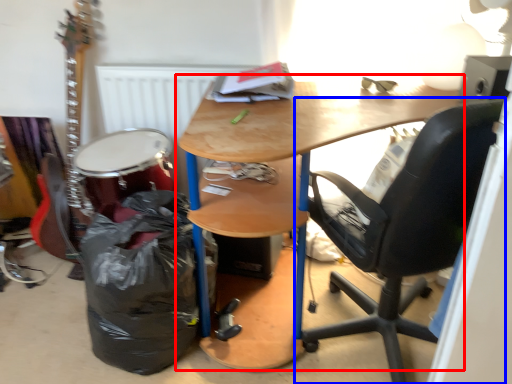
Question: Which object is closer to the camera taking this photo, desk (highlighted by a red box) or chair (highlighted by a blue box)?

Choices:
 (A) desk
 (B) chair

Answer: (B)